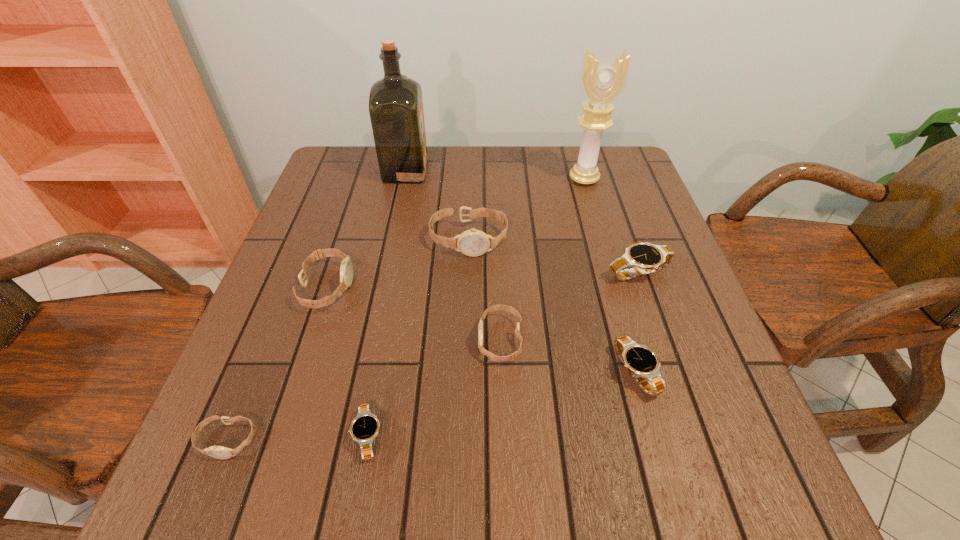
Identify the location of liquor. The height and width of the screenshot is (540, 960). (396, 112).

Where is `award`? This screenshot has width=960, height=540. award is located at coordinates (602, 80).

At what (x,y) coordinates should I click in order to perform the action: click on the third tallest object. Please return your answer as a coordinate pair (x, y). The width and height of the screenshot is (960, 540). Looking at the image, I should click on (473, 242).

This screenshot has width=960, height=540. I want to click on the tallest watch, so click(x=473, y=242).

You are a GUI agent. You are given a task and a screenshot of the screen. Output one action in this format:
    pyautogui.click(x=<x>, y=<y>)
    Task: Click on the second farthest beige watch
    
    Given the screenshot: What is the action you would take?
    pyautogui.click(x=346, y=270)

You are a GUI agent. You are given a task and a screenshot of the screen. Output one action in this format:
    pyautogui.click(x=<x>, y=<y>)
    Task: Click on the sixth shortest object
    The height and width of the screenshot is (540, 960).
    Given the screenshot: What is the action you would take?
    pyautogui.click(x=346, y=270)

Find the location of a particular element. the farthest black watch is located at coordinates (645, 258).

Identify the location of the second smallest beige watch. The height and width of the screenshot is (540, 960). (513, 356).

I want to click on the second biggest black watch, so click(x=641, y=362).

Image resolution: width=960 pixels, height=540 pixels. Identify the location of the nearest beige watch. click(x=219, y=452).